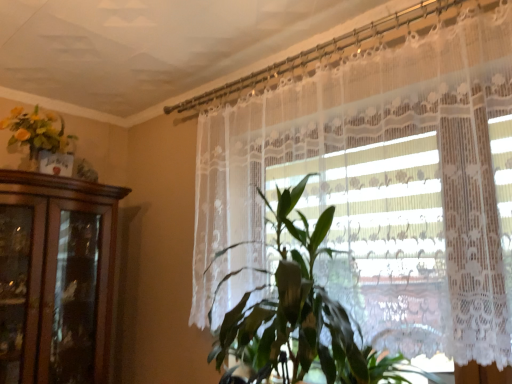
Question: Considering the relative positions of green leafy plant at center and matte yellow flowers at upper left in the image provided, is green leafy plant at center to the right of matte yellow flowers at upper left from the viewer's perspective?

Choices:
 (A) yes
 (B) no

Answer: (A)

Question: Could you tell me if green leafy plant at center is facing matte yellow flowers at upper left?

Choices:
 (A) no
 (B) yes

Answer: (A)

Question: Is green leafy plant at center outside matte yellow flowers at upper left?

Choices:
 (A) yes
 (B) no

Answer: (A)

Question: Considering the relative positions of green leafy plant at center and matte yellow flowers at upper left in the image provided, is green leafy plant at center in front of matte yellow flowers at upper left?

Choices:
 (A) no
 (B) yes

Answer: (B)

Question: Would you say matte yellow flowers at upper left is part of green leafy plant at center's contents?

Choices:
 (A) yes
 (B) no

Answer: (B)

Question: Can you confirm if green leafy plant at center is wider than matte yellow flowers at upper left?

Choices:
 (A) no
 (B) yes

Answer: (B)

Question: Is white lace curtain at center to the right of matte yellow flowers at upper left from the viewer's perspective?

Choices:
 (A) yes
 (B) no

Answer: (A)

Question: Considering the relative sizes of white lace curtain at center and matte yellow flowers at upper left in the image provided, is white lace curtain at center thinner than matte yellow flowers at upper left?

Choices:
 (A) yes
 (B) no

Answer: (A)

Question: Is white lace curtain at center positioned with its back to matte yellow flowers at upper left?

Choices:
 (A) no
 (B) yes

Answer: (A)

Question: Is white lace curtain at center directly adjacent to matte yellow flowers at upper left?

Choices:
 (A) yes
 (B) no

Answer: (B)

Question: Does white lace curtain at center have a greater width compared to matte yellow flowers at upper left?

Choices:
 (A) no
 (B) yes

Answer: (A)

Question: From a real-world perspective, is white lace curtain at center below matte yellow flowers at upper left?

Choices:
 (A) yes
 (B) no

Answer: (A)

Question: Is green leafy plant at center not close to white lace curtain at center?

Choices:
 (A) yes
 (B) no

Answer: (B)